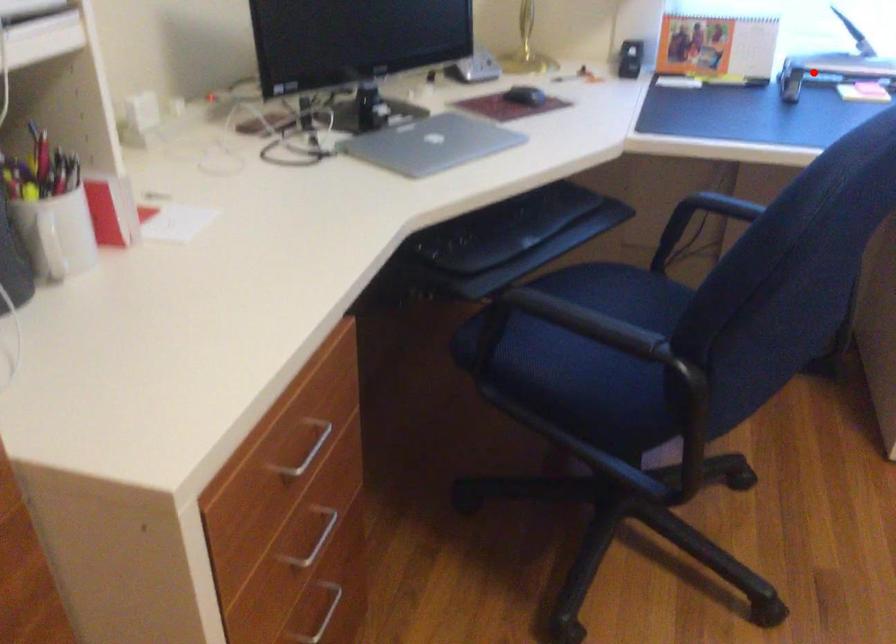
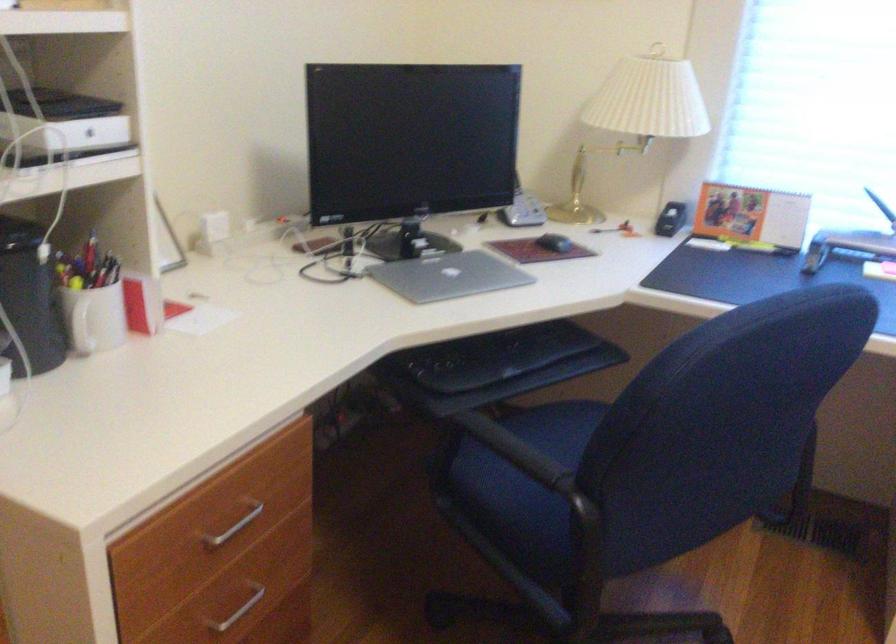
Question: I am providing you with two images of the same scene from different viewpoints. A red point is marked on the first image. Is the red point's position out of view in image 2?

Choices:
 (A) Yes
 (B) No

Answer: (B)